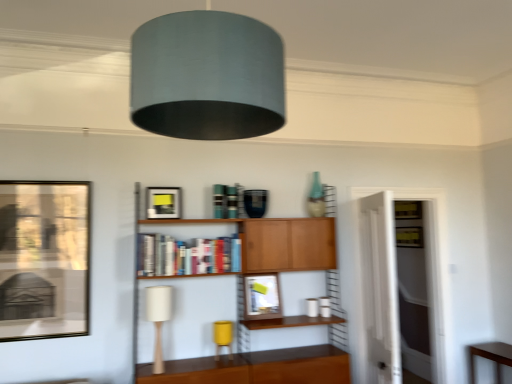
Measure the distance between point [85,231] and camera.

Point [85,231] is 3.13 meters from camera.

At what (x,y) coordinates should I click in order to perform the action: click on wooden cabinet at center. Please return your answer as a coordinate pair (x, y). Looking at the image, I should click on (255, 368).

This screenshot has height=384, width=512. I want to click on matte glass picture frame at center, placed as the first picture frame when sorted from right to left, so click(x=261, y=296).

What do you see at coordinates (163, 202) in the screenshot?
I see `matte black picture frame at upper center, which is the second picture frame in right-to-left order` at bounding box center [163, 202].

Measure the distance between point (155, 217) and camera.

The distance of point (155, 217) from camera is 3.26 meters.

Image resolution: width=512 pixels, height=384 pixels. What are the coordinates of `matte black picture frame at left, which ranks as the first picture frame in front-to-back order` in the screenshot? It's located at (44, 259).

Which is in front, matte black picture frame at left, the 3th picture frame from the back, or matte black picture frame at upper center, which is the second picture frame in right-to-left order?

Positioned in front is matte black picture frame at left, the 3th picture frame from the back.

In the scene shown: How different are the orientations of matte black picture frame at left, arranged as the third picture frame when viewed from the right, and matte black picture frame at upper center, which is the second picture frame in right-to-left order, in degrees?

0.176 degrees.

Consider the image. Is matte black picture frame at upper center, which is the second picture frame in right-to-left order, completely or partially inside matte black picture frame at left, arranged as the third picture frame when viewed from the right?

Definitely not — matte black picture frame at upper center, which is the second picture frame in right-to-left order, is not inside matte black picture frame at left, arranged as the third picture frame when viewed from the right.

Considering the relative sizes of matte black picture frame at left, arranged as the third picture frame when viewed from the right, and matte black picture frame at upper center, positioned as the 2th picture frame in front-to-back order, in the image provided, is matte black picture frame at left, arranged as the third picture frame when viewed from the right, taller than matte black picture frame at upper center, positioned as the 2th picture frame in front-to-back order,?

Yes, matte black picture frame at left, arranged as the third picture frame when viewed from the right, is taller than matte black picture frame at upper center, positioned as the 2th picture frame in front-to-back order.

From their relative heights in the image, would you say transparent glass door at right is taller or shorter than matte glass picture frame at center, placed as the first picture frame when sorted from right to left?

Considering their sizes, transparent glass door at right has more height than matte glass picture frame at center, placed as the first picture frame when sorted from right to left.

From a real-world perspective, who is located higher, transparent glass door at right or matte glass picture frame at center, placed as the first picture frame when sorted from right to left?

matte glass picture frame at center, placed as the first picture frame when sorted from right to left, from a real-world perspective.

Considering the sizes of objects yellow matte table lamp at lower center, the 2th table lamp in the front-to-back sequence, and brown wooden table at lower right in the image provided, who is thinner, yellow matte table lamp at lower center, the 2th table lamp in the front-to-back sequence, or brown wooden table at lower right?

yellow matte table lamp at lower center, the 2th table lamp in the front-to-back sequence.

Is yellow matte table lamp at lower center, the 1th table lamp when ordered from back to front, at the right side of brown wooden table at lower right?

Incorrect, yellow matte table lamp at lower center, the 1th table lamp when ordered from back to front, is not on the right side of brown wooden table at lower right.

Considering the sizes of objects yellow matte table lamp at lower center, arranged as the first table lamp when viewed from the right, and brown wooden table at lower right in the image provided, who is taller, yellow matte table lamp at lower center, arranged as the first table lamp when viewed from the right, or brown wooden table at lower right?

With more height is brown wooden table at lower right.

Who is shorter, matte glass picture frame at center, which is the 3th picture frame in front-to-back order, or matte black picture frame at upper center, which is counted as the second picture frame, starting from the back?

Standing shorter between the two is matte black picture frame at upper center, which is counted as the second picture frame, starting from the back.

From a real-world perspective, who is located higher, matte glass picture frame at center, which is the third picture frame from left to right, or matte black picture frame at upper center, positioned as the 2th picture frame in front-to-back order?

matte black picture frame at upper center, positioned as the 2th picture frame in front-to-back order.

What's the angular difference between matte glass picture frame at center, placed as the first picture frame when sorted from right to left, and matte black picture frame at upper center, the 2th picture frame when ordered from left to right,'s facing directions?

3.9 degrees separate the facing orientations of matte glass picture frame at center, placed as the first picture frame when sorted from right to left, and matte black picture frame at upper center, the 2th picture frame when ordered from left to right.

Is matte glass picture frame at center, placed as the first picture frame when sorted from right to left, wider or thinner than matte black picture frame at upper center, which is the second picture frame in right-to-left order?

In the image, matte glass picture frame at center, placed as the first picture frame when sorted from right to left, appears to be wider than matte black picture frame at upper center, which is the second picture frame in right-to-left order.

Which object is thinner, matte black picture frame at left, acting as the first picture frame starting from the left, or brown wooden table at lower right?

Thinner between the two is matte black picture frame at left, acting as the first picture frame starting from the left.

Considering the sizes of objects matte black picture frame at left, the 3th picture frame from the back, and brown wooden table at lower right in the image provided, who is taller, matte black picture frame at left, the 3th picture frame from the back, or brown wooden table at lower right?

With more height is matte black picture frame at left, the 3th picture frame from the back.

Is matte black picture frame at left, acting as the first picture frame starting from the left, not within brown wooden table at lower right?

Yes, matte black picture frame at left, acting as the first picture frame starting from the left, is not within brown wooden table at lower right.

In terms of size, does matte black picture frame at left, the 3th picture frame from the back, appear bigger or smaller than brown wooden table at lower right?

matte black picture frame at left, the 3th picture frame from the back, is smaller than brown wooden table at lower right.

Is brown wooden table at lower right bigger or smaller than matte glass picture frame at center, which is the 3th picture frame in front-to-back order?

Considering their sizes, brown wooden table at lower right takes up more space than matte glass picture frame at center, which is the 3th picture frame in front-to-back order.

Can you tell me how much brown wooden table at lower right and matte glass picture frame at center, placed as the first picture frame when sorted from right to left, differ in facing direction?

90.9 degrees separate the facing orientations of brown wooden table at lower right and matte glass picture frame at center, placed as the first picture frame when sorted from right to left.

Does point (500, 353) lie in front of point (246, 286)?

That is False.

Looking at this image, is brown wooden table at lower right not inside matte glass picture frame at center, which is the 1th picture frame from back to front?

Absolutely, brown wooden table at lower right is external to matte glass picture frame at center, which is the 1th picture frame from back to front.

From a real-world perspective, who is located higher, brown wooden table at lower right or hardcover books at center?

From a 3D spatial view, hardcover books at center is above.

Is there a large distance between brown wooden table at lower right and hardcover books at center?

brown wooden table at lower right is far away from hardcover books at center.

Can you confirm if brown wooden table at lower right is positioned to the left of hardcover books at center?

In fact, brown wooden table at lower right is to the right of hardcover books at center.

Does brown wooden table at lower right have a greater height compared to hardcover books at center?

Indeed, brown wooden table at lower right has a greater height compared to hardcover books at center.

This screenshot has height=384, width=512. I want to click on the 1st picture frame located beneath the matte black picture frame at upper center, positioned as the 2th picture frame in front-to-back order (from a real-world perspective), so pyautogui.click(x=44, y=259).

At what (x,y) coordinates should I click in order to perform the action: click on the 1st picture frame counting from the left of the transparent glass door at right. Please return your answer as a coordinate pair (x, y). Looking at the image, I should click on (261, 296).

Estimate the real-world distances between objects in this image. Which object is closer to wooden cabinet at center, matte black picture frame at left, the 3th picture frame from the back, or transparent glass door at right?

Based on the image, matte black picture frame at left, the 3th picture frame from the back, appears to be nearer to wooden cabinet at center.

When comparing their distances from brown wooden table at lower right, does matte black picture frame at upper center, which is counted as the second picture frame, starting from the back, or yellow matte table lamp at lower center, the 1th table lamp when ordered from back to front, seem further?

matte black picture frame at upper center, which is counted as the second picture frame, starting from the back, lies further to brown wooden table at lower right than the other object.

Based on their spatial positions, is matte black picture frame at left, arranged as the third picture frame when viewed from the right, or matte glass picture frame at center, which is the 3th picture frame in front-to-back order, closer to wooden cabinet at center?

The object closer to wooden cabinet at center is matte glass picture frame at center, which is the 3th picture frame in front-to-back order.

From the image, which object appears to be farther from matte glass picture frame at center, which is the third picture frame from left to right, hardcover books at center or matte black picture frame at left, which ranks as the first picture frame in front-to-back order?

Among the two, matte black picture frame at left, which ranks as the first picture frame in front-to-back order, is located further to matte glass picture frame at center, which is the third picture frame from left to right.

Estimate the real-world distances between objects in this image. Which object is further from matte black picture frame at upper center, positioned as the 2th picture frame in front-to-back order, matte glass picture frame at center, which is the 3th picture frame in front-to-back order, or matte black picture frame at left, the 3th picture frame from the back?

matte glass picture frame at center, which is the 3th picture frame in front-to-back order, is further to matte black picture frame at upper center, positioned as the 2th picture frame in front-to-back order.

Considering their positions, is wooden cabinet at center positioned closer to matte glass picture frame at center, which is the 3th picture frame in front-to-back order, than white fabric table lamp at lower left, arranged as the 1th table lamp when viewed from the front?

The object closer to matte glass picture frame at center, which is the 3th picture frame in front-to-back order, is wooden cabinet at center.

Estimate the real-world distances between objects in this image. Which object is closer to wooden cabinet at center, transparent glass door at right or matte black picture frame at upper center, which is counted as the second picture frame, starting from the back?

matte black picture frame at upper center, which is counted as the second picture frame, starting from the back, is positioned closer to the anchor wooden cabinet at center.

Estimate the real-world distances between objects in this image. Which object is further from white fabric table lamp at lower left, the first table lamp from the left, brown wooden table at lower right or yellow matte table lamp at lower center, the 2th table lamp in the front-to-back sequence?

brown wooden table at lower right is further to white fabric table lamp at lower left, the first table lamp from the left.

Locate an element on the screen. The image size is (512, 384). shelf between matte black picture frame at upper center, the 2th picture frame when ordered from left to right, and brown wooden table at lower right is located at coordinates (255, 368).

This screenshot has height=384, width=512. Identify the location of book between white fabric table lamp at lower left, arranged as the 1th table lamp when viewed from the front, and matte glass picture frame at center, which is the 3th picture frame in front-to-back order, from left to right. (187, 255).

Locate an element on the screen. This screenshot has width=512, height=384. picture frame between matte black picture frame at left, which ranks as the first picture frame in front-to-back order, and hardcover books at center, in the horizontal direction is located at coordinates 163,202.

Image resolution: width=512 pixels, height=384 pixels. Find the location of `picture frame between matte black picture frame at upper center, which is the second picture frame in right-to-left order, and brown wooden table at lower right from left to right`. picture frame between matte black picture frame at upper center, which is the second picture frame in right-to-left order, and brown wooden table at lower right from left to right is located at coordinates [x=261, y=296].